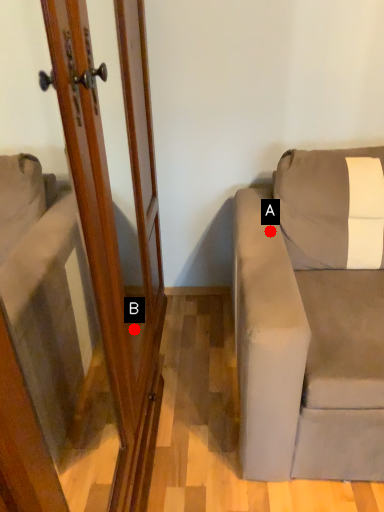
Question: Two points are circled on the image, labeled by A and B beside each circle. Which point is farther from the camera taking this photo?

Choices:
 (A) A is further
 (B) B is further

Answer: (B)